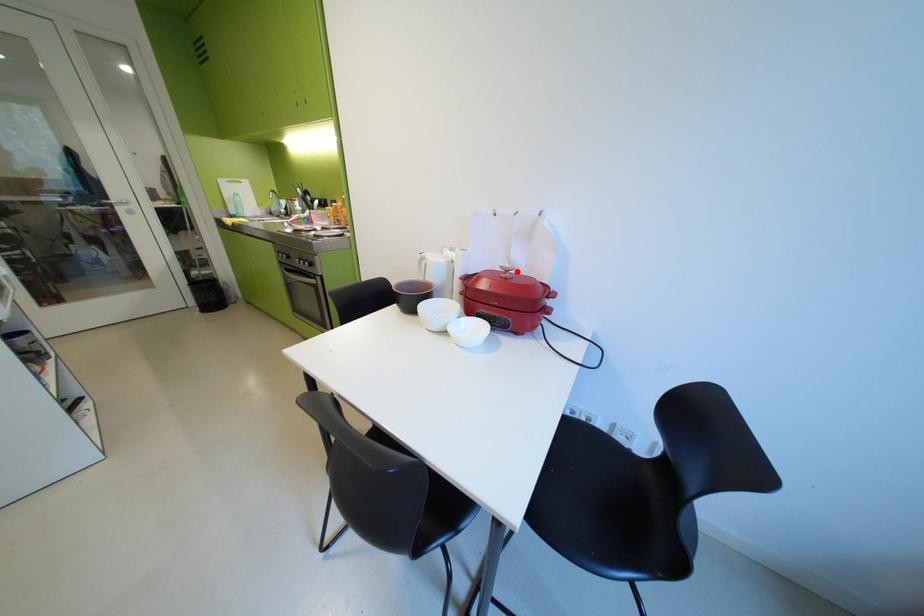
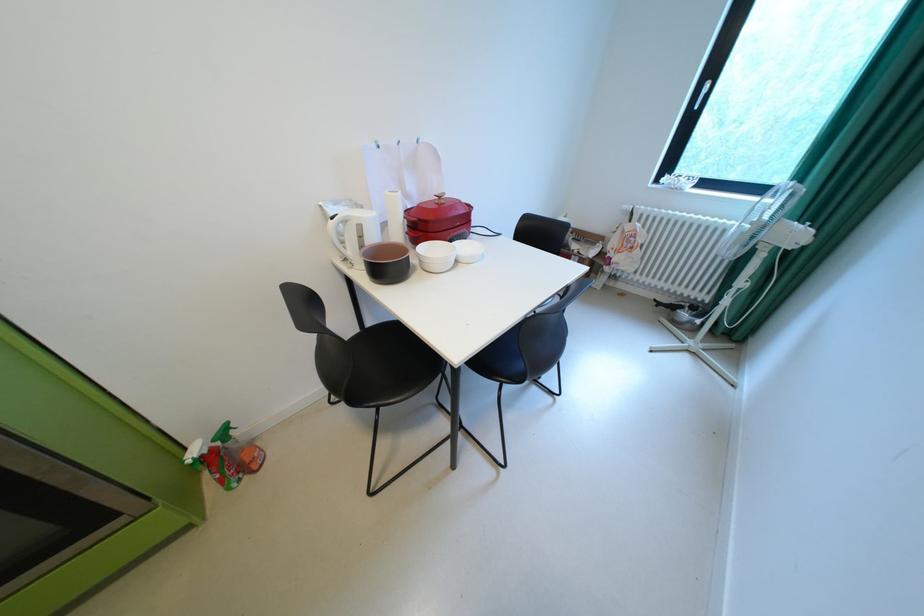
Where in the second image is the point corresponding to the highlighted location from the first image?

(450, 198)